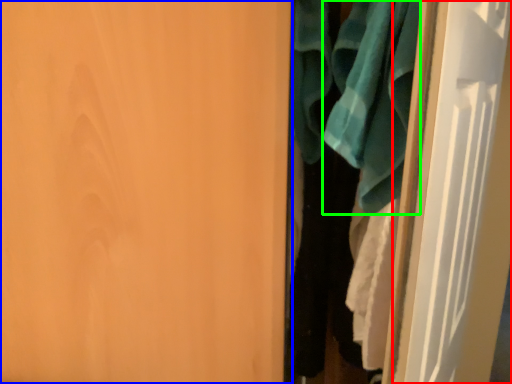
Question: Which is farther away from door (highlighted by a red box)? door (highlighted by a blue box) or bath towel (highlighted by a green box)?

Choices:
 (A) door
 (B) bath towel

Answer: (A)